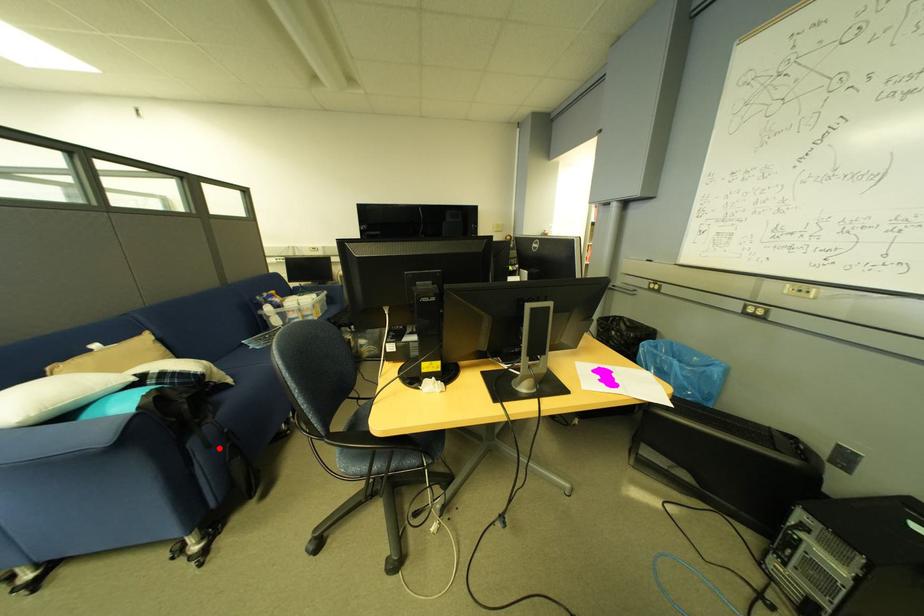
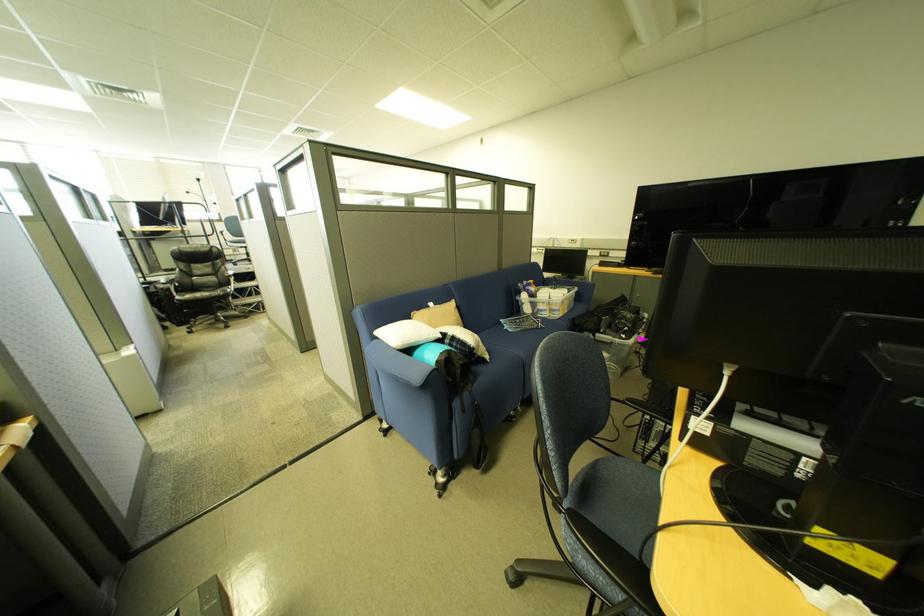
The point at the highlighted location is marked in the first image. Where is the corresponding point in the second image?

(475, 413)